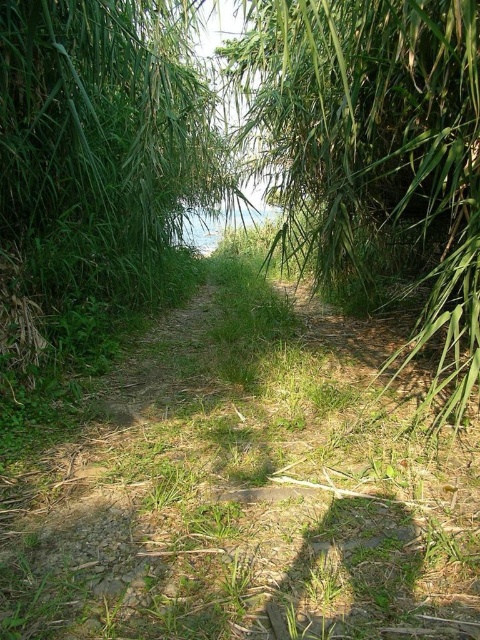
Question: Which object appears farthest from the camera in this image?

Choices:
 (A) green leafy plant at center
 (B) green grass at center

Answer: (A)

Question: Which point is closer to the camera?

Choices:
 (A) green grass at center
 (B) green leafy plant at center

Answer: (A)

Question: Is green grass at center bigger than green leafy plant at center?

Choices:
 (A) yes
 (B) no

Answer: (B)

Question: Which object appears farthest from the camera in this image?

Choices:
 (A) green grass at center
 (B) green leafy plant at center

Answer: (B)

Question: Is green grass at center positioned in front of green leafy plant at center?

Choices:
 (A) yes
 (B) no

Answer: (A)

Question: Is green grass at center above green leafy plant at center?

Choices:
 (A) no
 (B) yes

Answer: (A)